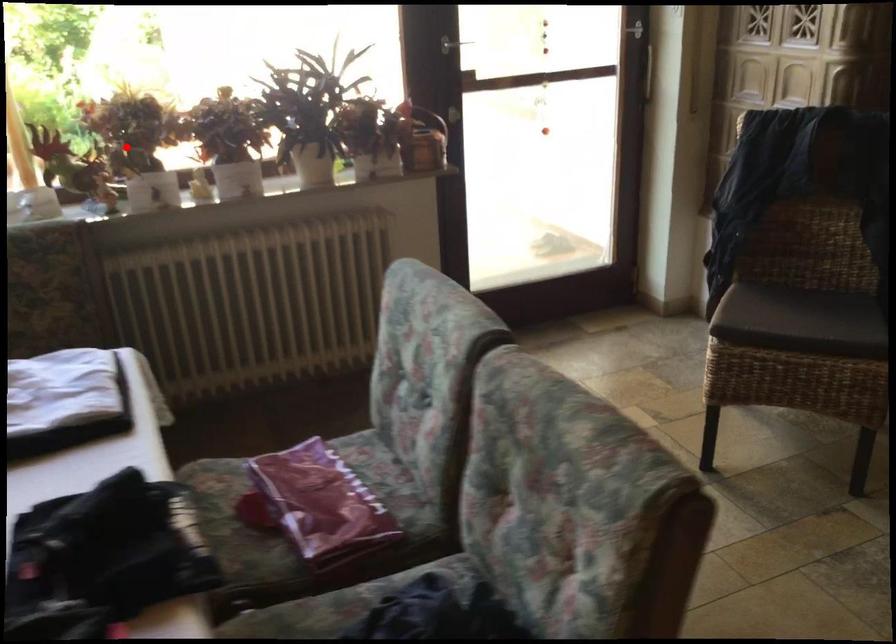
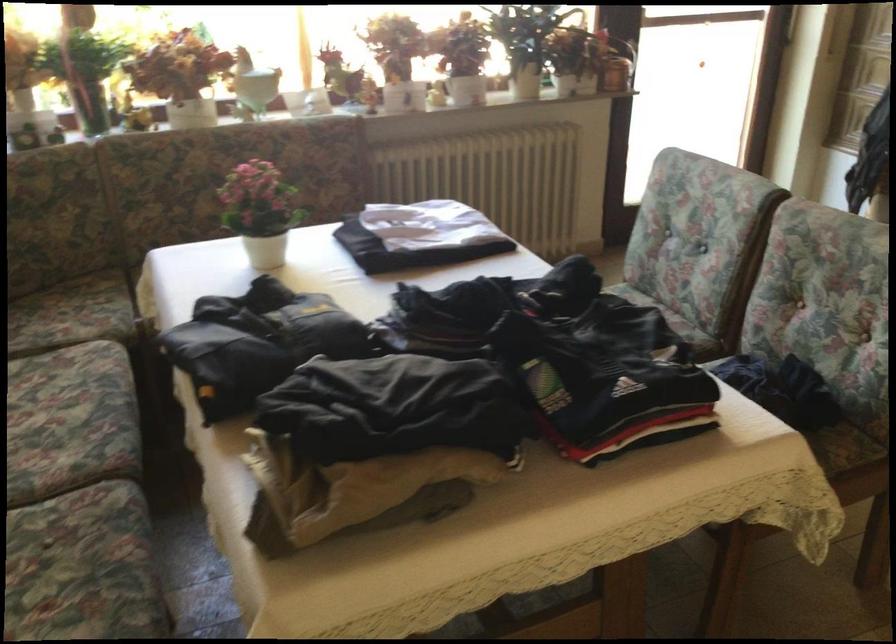
Question: I am providing you with two images of the same scene from different viewpoints. A red point is marked on the first image. At the location where the point appears in image 1, is it still visible in image 2?

Choices:
 (A) Yes
 (B) No

Answer: (A)